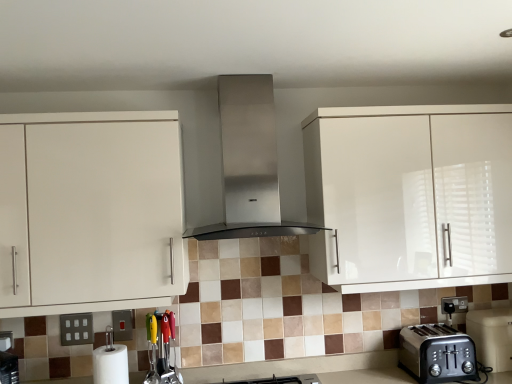
Question: From a real-world perspective, is brushed metal switch at lower left positioned above or below stainless steel range hood at center?

Choices:
 (A) below
 (B) above

Answer: (A)

Question: Considering the positions of brushed metal switch at lower left and stainless steel range hood at center in the image, is brushed metal switch at lower left taller or shorter than stainless steel range hood at center?

Choices:
 (A) tall
 (B) short

Answer: (B)

Question: Based on their relative distances, which object is nearer to the glossy white cabinet at upper right, the first cabinetry from the right?

Choices:
 (A) brushed metal switch at lower left
 (B) white glossy cabinet at left, the 1th cabinetry positioned from the left
 (C) white matte paper towel at lower left
 (D) satin silver outlet at lower left
 (E) multicolored plastic utensils at lower center, which is the 2th appliance from right to left

Answer: (B)

Question: Considering the real-world distances, which object is closest to the stainless steel range hood at center?

Choices:
 (A) white matte paper towel at lower left
 (B) matte black toaster at lower right
 (C) satin silver outlet at lower left
 (D) black plastic toaster at lower right, placed as the 2th appliance when sorted from front to back
 (E) brushed metal switch at lower left

Answer: (E)